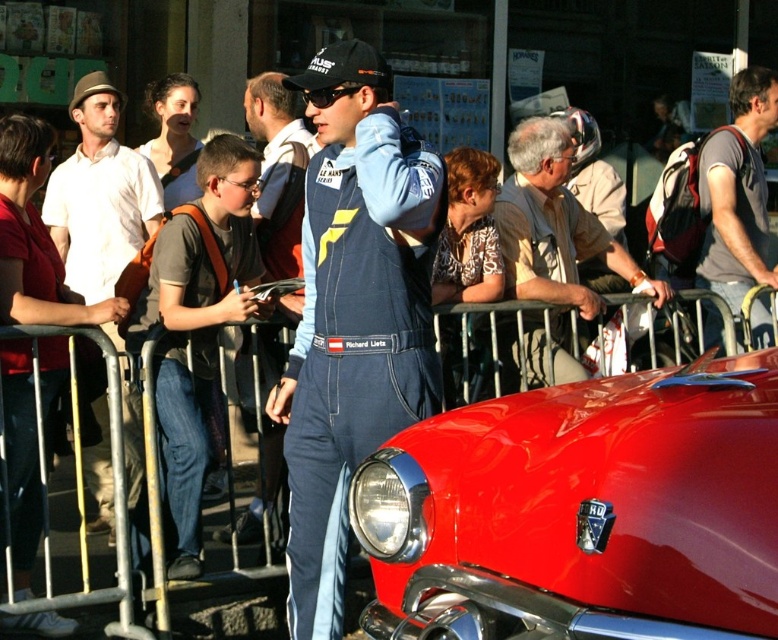
Question: Among these points, which one is farthest from the camera?

Choices:
 (A) (386, 317)
 (B) (629, 456)
 (C) (300, 298)
 (D) (538, 330)

Answer: (D)

Question: Observing the image, what is the correct spatial positioning of matte white shirt at left in reference to light brown leather jacket at center?

Choices:
 (A) right
 (B) left

Answer: (B)

Question: Does light brown leather jacket at center have a greater width compared to gray fabric backpack at right?

Choices:
 (A) yes
 (B) no

Answer: (A)

Question: Which point appears farthest from the camera in this image?

Choices:
 (A) (734, 237)
 (B) (55, 195)
 (C) (321, 451)
 (D) (657, 627)

Answer: (A)

Question: Is denim jumpsuit at center bigger than gray fabric backpack at right?

Choices:
 (A) no
 (B) yes

Answer: (B)

Question: Which is nearer to the blue denim jumpsuit at center?

Choices:
 (A) gray fabric backpack at right
 (B) shiny red car at center
 (C) light brown leather jacket at center
 (D) denim jumpsuit at center

Answer: (B)